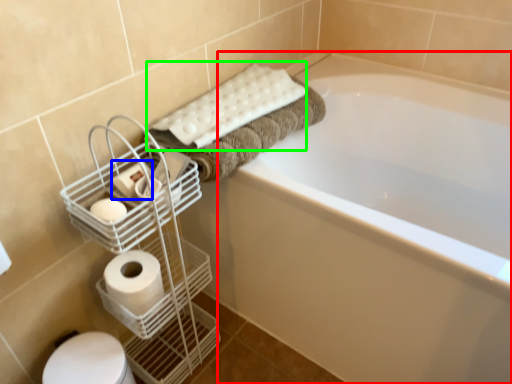
Question: Which object is the farthest from bathtub (highlighted by a red box)? Choose among these: toilet paper (highlighted by a blue box) or bath towel (highlighted by a green box).

Choices:
 (A) toilet paper
 (B) bath towel

Answer: (A)